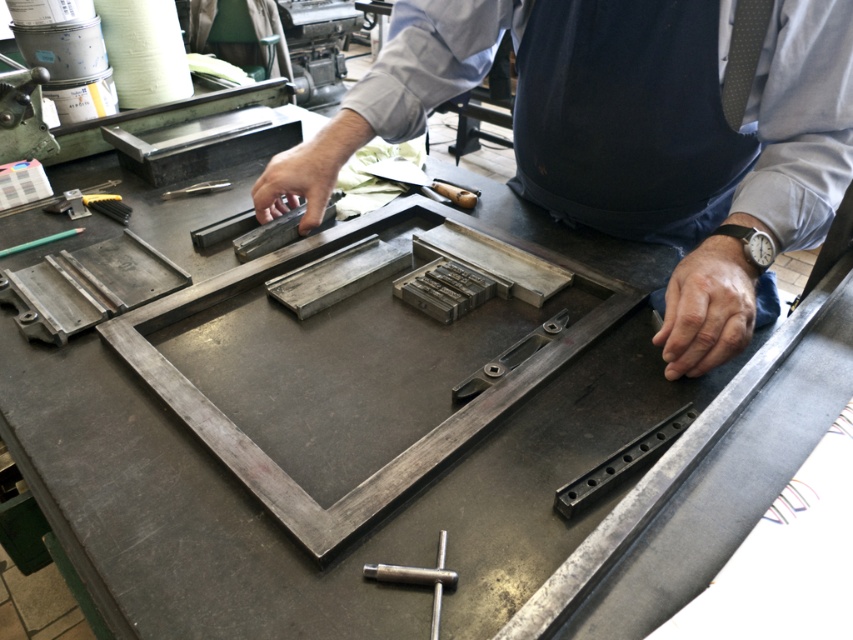
You are a worker who needs to reach the metallic gray metal bar at center to adjust it. Your arm can extend 18 inches. Can you reach it without moving from your current position while wearing the dark blue fabric apron at center?

The dark blue fabric apron at center is 18.70 inches from the metallic gray metal bar at center. Since your arm can only extend 18 inches, you cannot reach the metallic gray metal bar at center without moving because the apron is slightly closer than your reach.

You are an apprentice in a workshop and need to place both the silver metallic wrench at center and the metallic gray tool at center into a drawer. The drawer has limited space. Which object should you place first to ensure both fit?

You should place the metallic gray tool at center first because it occupies more space than the silver metallic wrench at center, allowing the smaller wrench to fit alongside it.